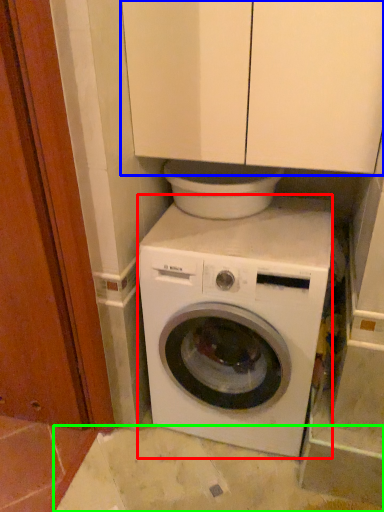
Question: Based on their relative distances, which object is farther from washing machine (highlighted by a red box)? Choose from cabinetry (highlighted by a blue box) and concrete (highlighted by a green box).

Choices:
 (A) cabinetry
 (B) concrete

Answer: (A)